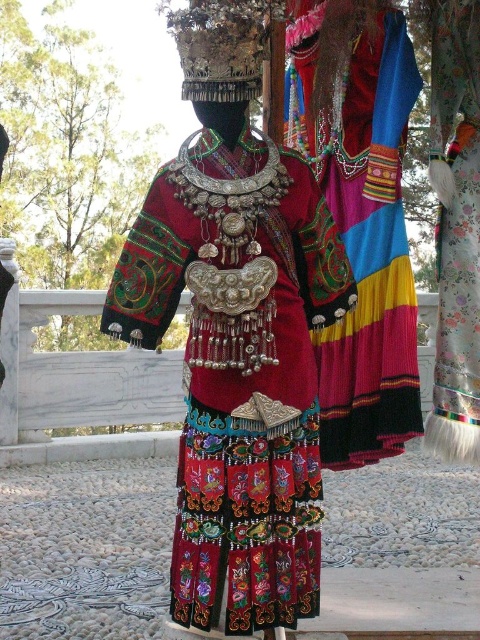
What do you see at coordinates (239, 369) in the screenshot? The height and width of the screenshot is (640, 480). I see `velvet embroidered dress at center` at bounding box center [239, 369].

Does velvet embroidered dress at center appear on the right side of velvet floral skirt at center?

In fact, velvet embroidered dress at center is to the left of velvet floral skirt at center.

Which is behind, point (228, 502) or point (439, 140)?

The point (439, 140) is behind.

This screenshot has height=640, width=480. What are the coordinates of `velvet embroidered dress at center` in the screenshot? It's located at (239, 369).

Which is more to the right, embroidered silk skirt at center or velvet floral skirt at center?

Positioned to the right is velvet floral skirt at center.

Does embroidered silk skirt at center have a lesser width compared to velvet floral skirt at center?

In fact, embroidered silk skirt at center might be wider than velvet floral skirt at center.

Which is behind, point (343, 408) or point (466, 52)?

Point (343, 408)

Image resolution: width=480 pixels, height=640 pixels. I want to click on embroidered silk skirt at center, so click(360, 227).

Which is in front, point (207, 536) or point (302, 4)?

Positioned in front is point (207, 536).

Is velvet embroidered dress at center positioned at the back of embroidered silk skirt at center?

No, it is in front of embroidered silk skirt at center.

This screenshot has height=640, width=480. What do you see at coordinates (239, 369) in the screenshot?
I see `velvet embroidered dress at center` at bounding box center [239, 369].

The height and width of the screenshot is (640, 480). Identify the location of velvet embroidered dress at center. (239, 369).